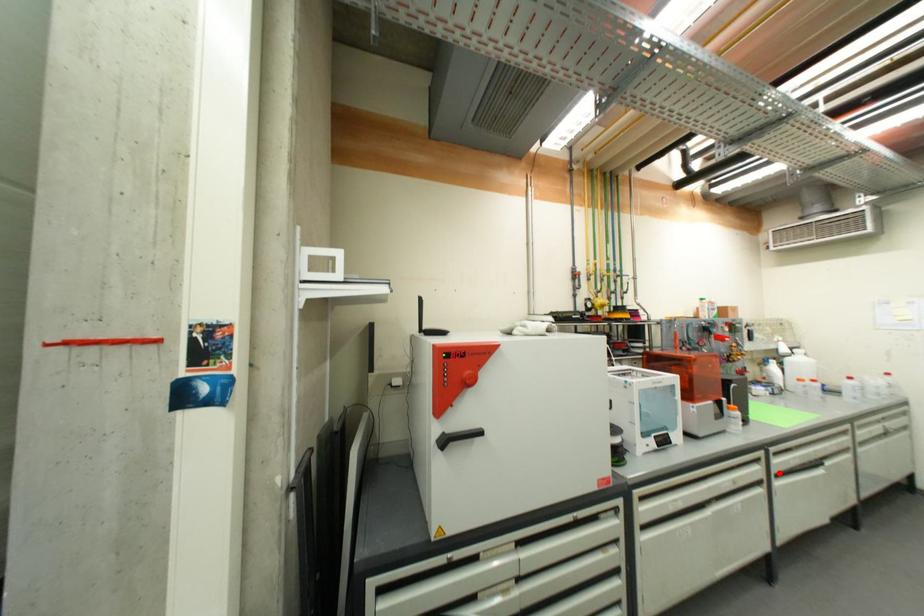
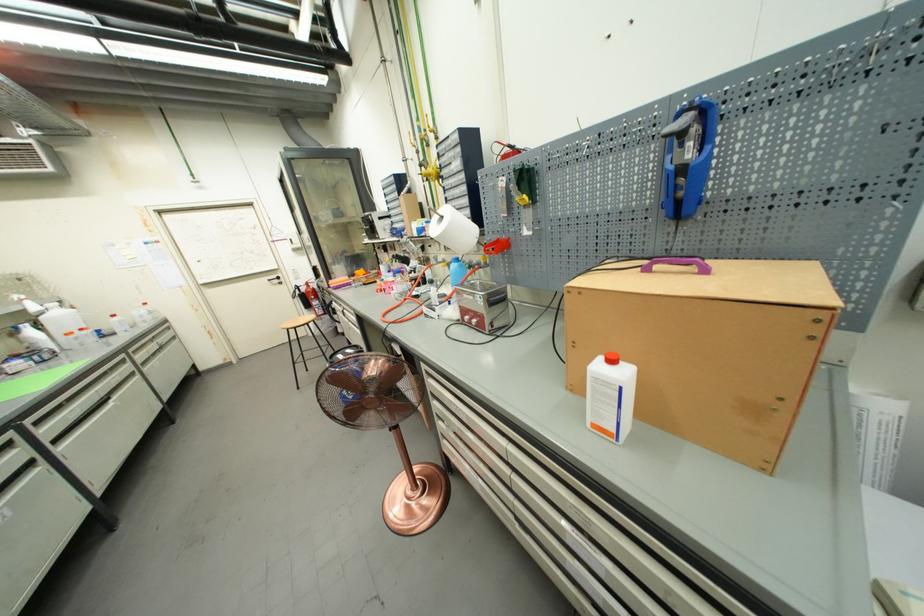
Question: I am providing you with two images of the same scene from different viewpoints. A red point is marked on the first image. Can you still see the location of the red point in image 2?

Choices:
 (A) Yes
 (B) No

Answer: (A)